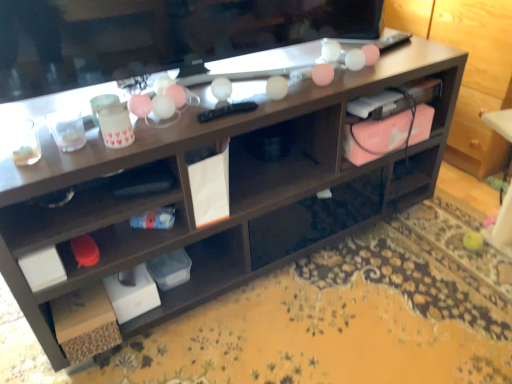
Question: Considering the relative sizes of matte black television at upper center and pink matte laptop at right in the image provided, is matte black television at upper center wider than pink matte laptop at right?

Choices:
 (A) yes
 (B) no

Answer: (A)

Question: Does matte black television at upper center turn towards pink matte laptop at right?

Choices:
 (A) no
 (B) yes

Answer: (A)

Question: Are matte black television at upper center and pink matte laptop at right beside each other?

Choices:
 (A) no
 (B) yes

Answer: (A)

Question: Would you say matte black television at upper center is outside pink matte laptop at right?

Choices:
 (A) no
 (B) yes

Answer: (B)

Question: From the image's perspective, is matte black television at upper center located above pink matte laptop at right?

Choices:
 (A) no
 (B) yes

Answer: (B)

Question: From a real-world perspective, is matte black television at upper center physically above pink matte laptop at right?

Choices:
 (A) yes
 (B) no

Answer: (A)

Question: Is pink matte laptop at right far from matte black television at upper center?

Choices:
 (A) yes
 (B) no

Answer: (B)

Question: From the image's perspective, is pink matte laptop at right under matte black television at upper center?

Choices:
 (A) no
 (B) yes

Answer: (B)

Question: Is pink matte laptop at right taller than matte black television at upper center?

Choices:
 (A) no
 (B) yes

Answer: (A)

Question: Considering the relative sizes of pink matte laptop at right and matte black television at upper center in the image provided, is pink matte laptop at right smaller than matte black television at upper center?

Choices:
 (A) yes
 (B) no

Answer: (A)

Question: Is matte black television at upper center surrounded by pink matte laptop at right?

Choices:
 (A) no
 (B) yes

Answer: (A)

Question: From a real-world perspective, is pink matte laptop at right on matte black television at upper center?

Choices:
 (A) no
 (B) yes

Answer: (A)

Question: From a real-world perspective, relative to matte black television at upper center, is pink matte laptop at right vertically above or below?

Choices:
 (A) above
 (B) below

Answer: (B)